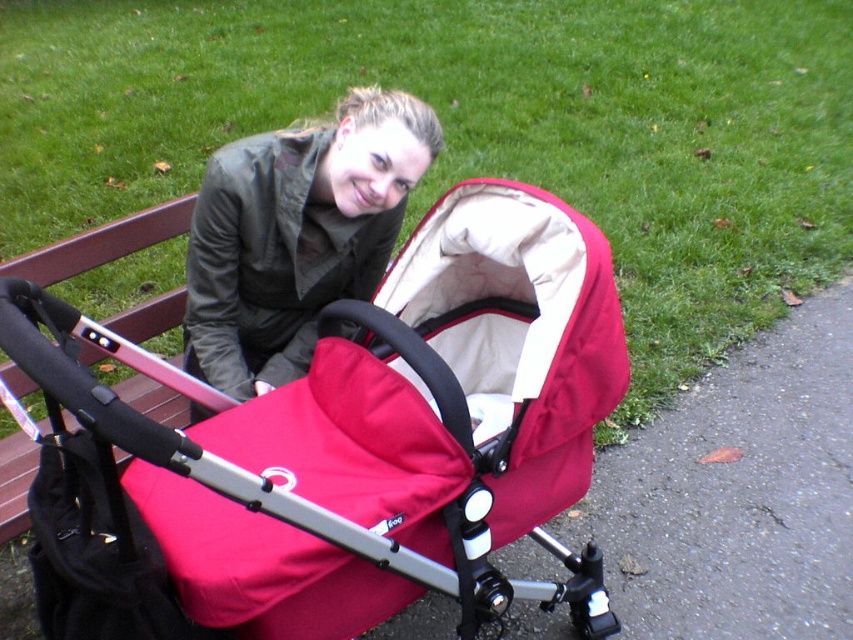
Question: Can you confirm if matte red baby carriage at center is positioned above matte green jacket at center?

Choices:
 (A) no
 (B) yes

Answer: (A)

Question: Is matte red baby carriage at center to the right of matte green jacket at center from the viewer's perspective?

Choices:
 (A) yes
 (B) no

Answer: (A)

Question: Which point is farther to the camera?

Choices:
 (A) matte red baby carriage at center
 (B) matte green jacket at center

Answer: (B)

Question: Considering the relative positions of matte red baby carriage at center and matte green jacket at center in the image provided, where is matte red baby carriage at center located with respect to matte green jacket at center?

Choices:
 (A) right
 (B) left

Answer: (A)

Question: Which of the following is the farthest from the observer?

Choices:
 (A) (527, 202)
 (B) (386, 225)

Answer: (B)

Question: Which of the following is the closest to the observer?

Choices:
 (A) (316, 182)
 (B) (61, 467)

Answer: (B)